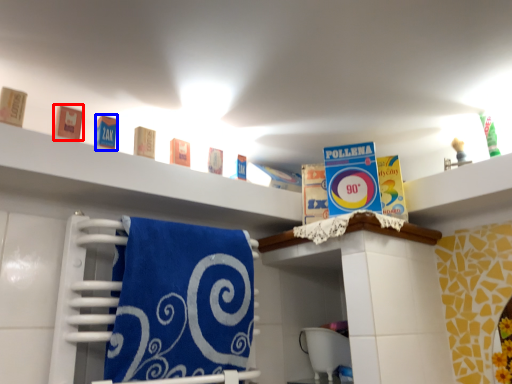
Question: Among these objects, which one is nearest to the camera, product (highlighted by a red box) or product (highlighted by a blue box)?

Choices:
 (A) product
 (B) product

Answer: (A)